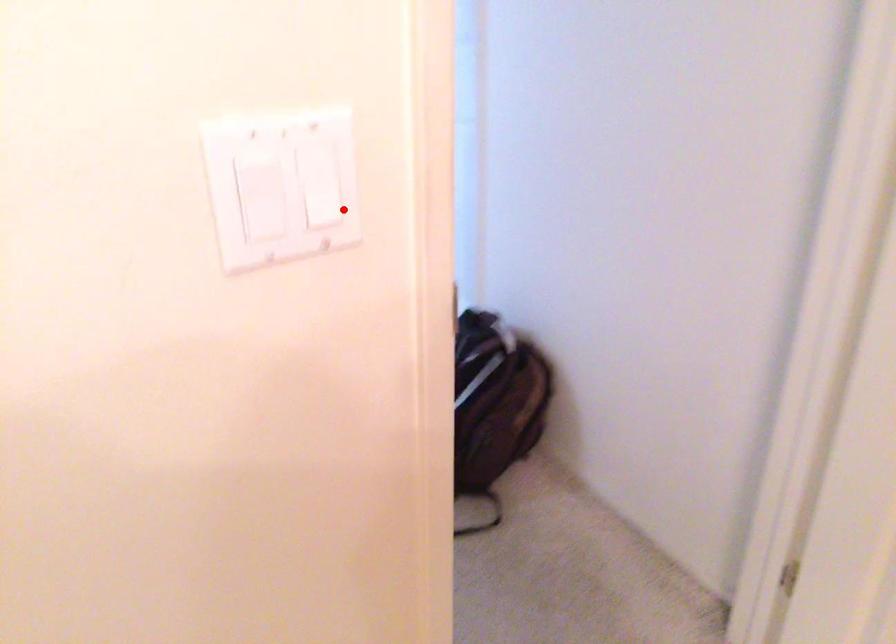
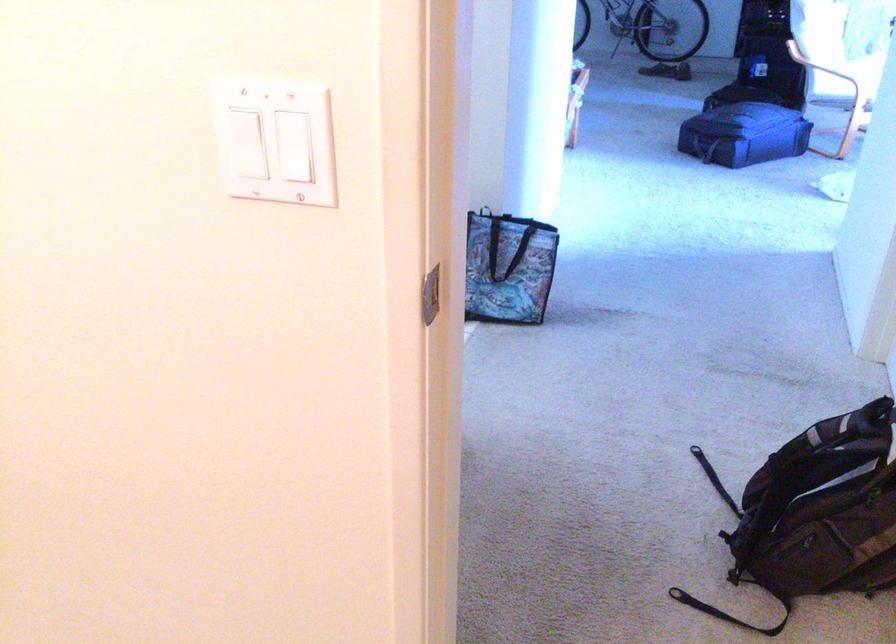
Question: I am providing you with two images of the same scene from different viewpoints. Image1 has a red point marked. In image2, the corresponding 3D location appears at what relative position? Reply with the corresponding letter.

Choices:
 (A) Closer
 (B) Farther

Answer: (B)